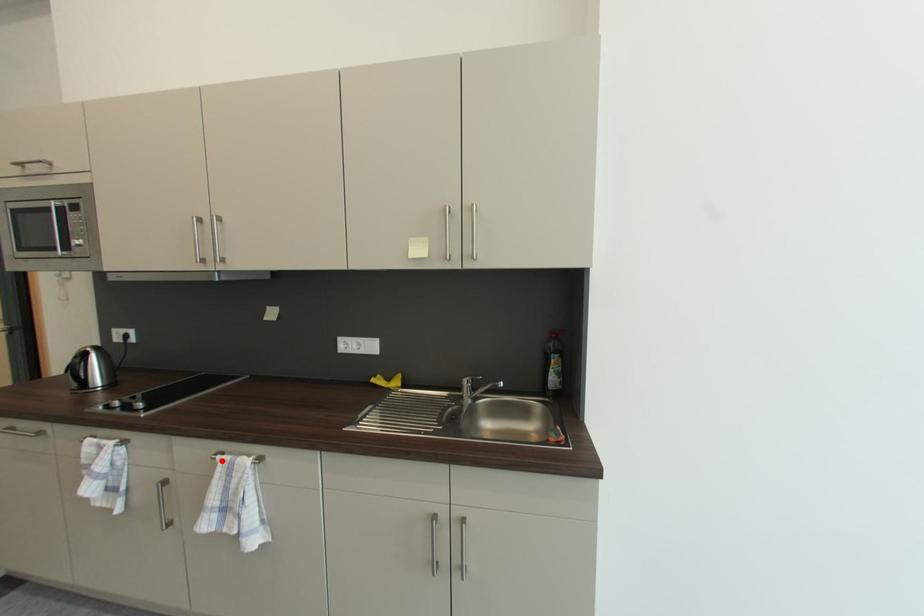
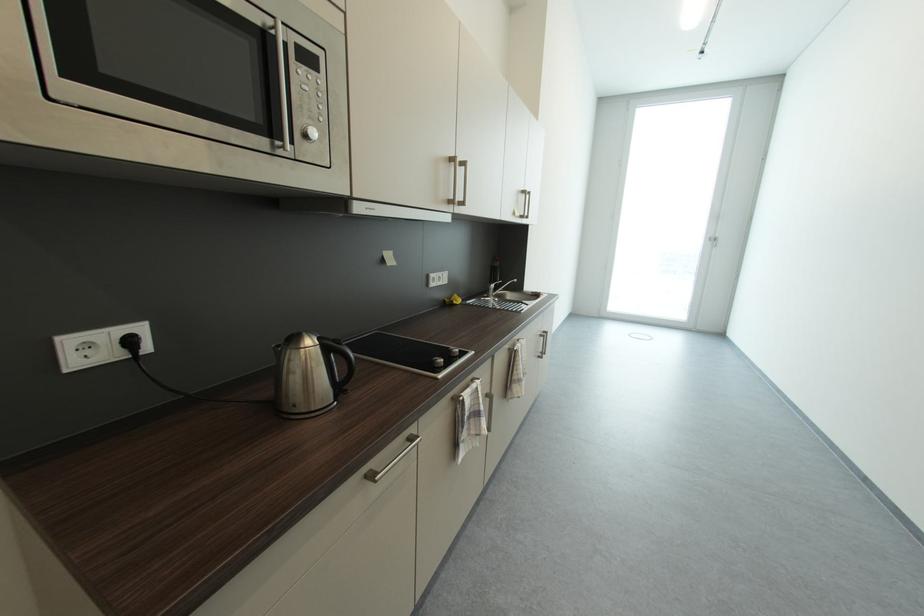
The point at the highlighted location is marked in the first image. Where is the corresponding point in the second image?

(523, 351)